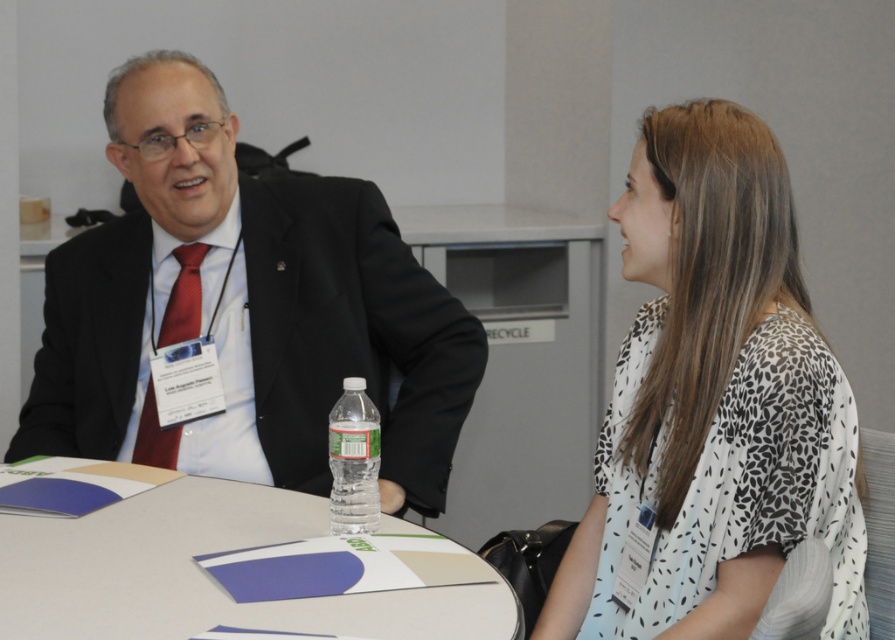
You are a security guard at the conference and need to ensure that attendees maintain a 6 feet social distance. The man on the left and the woman on the right are standing at the coordinates point (699, 164). Are they violating the social distancing rule?

The man on the left and the woman on the right are 5.08 feet apart, which is less than the required 6 feet social distance. Therefore, they are violating the social distancing rule.

You are an event organizer who needs to arrange name tags for attendees. You see the matte black suit at center and the white dotted blouse at center. Which attendee should you approach first if you want to place a name tag on the person closer to the front?

The matte black suit at center is closer to the front than the white dotted blouse at center, so you should approach the attendee wearing the matte black suit at center first.